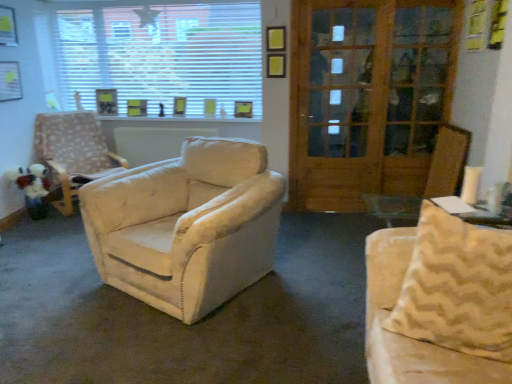
Question: Considering the relative sizes of beige fabric couch at right and wooden screen door at right in the image provided, is beige fabric couch at right shorter than wooden screen door at right?

Choices:
 (A) no
 (B) yes

Answer: (B)

Question: Can you confirm if beige fabric couch at right is taller than wooden screen door at right?

Choices:
 (A) no
 (B) yes

Answer: (A)

Question: Is beige fabric couch at right at the left side of wooden screen door at right?

Choices:
 (A) no
 (B) yes

Answer: (A)

Question: Considering the relative sizes of beige fabric couch at right and wooden screen door at right in the image provided, is beige fabric couch at right bigger than wooden screen door at right?

Choices:
 (A) no
 (B) yes

Answer: (B)

Question: From the image's perspective, is beige fabric couch at right under wooden screen door at right?

Choices:
 (A) no
 (B) yes

Answer: (B)

Question: Is beige fabric couch at right directly adjacent to wooden screen door at right?

Choices:
 (A) no
 (B) yes

Answer: (A)

Question: From a real-world perspective, is wooden door at center under beige fabric armchair at left?

Choices:
 (A) no
 (B) yes

Answer: (A)

Question: Considering the relative sizes of wooden door at center and beige fabric armchair at left in the image provided, is wooden door at center taller than beige fabric armchair at left?

Choices:
 (A) yes
 (B) no

Answer: (A)

Question: Is wooden door at center wider than beige fabric armchair at left?

Choices:
 (A) yes
 (B) no

Answer: (B)

Question: Considering the relative sizes of wooden door at center and beige fabric armchair at left in the image provided, is wooden door at center thinner than beige fabric armchair at left?

Choices:
 (A) no
 (B) yes

Answer: (B)

Question: From the image's perspective, is wooden door at center located beneath beige fabric armchair at left?

Choices:
 (A) no
 (B) yes

Answer: (A)

Question: Is wooden door at center bigger than beige fabric armchair at left?

Choices:
 (A) no
 (B) yes

Answer: (A)

Question: Does white plush toy at left lie behind beige fabric armchair at left?

Choices:
 (A) yes
 (B) no

Answer: (A)